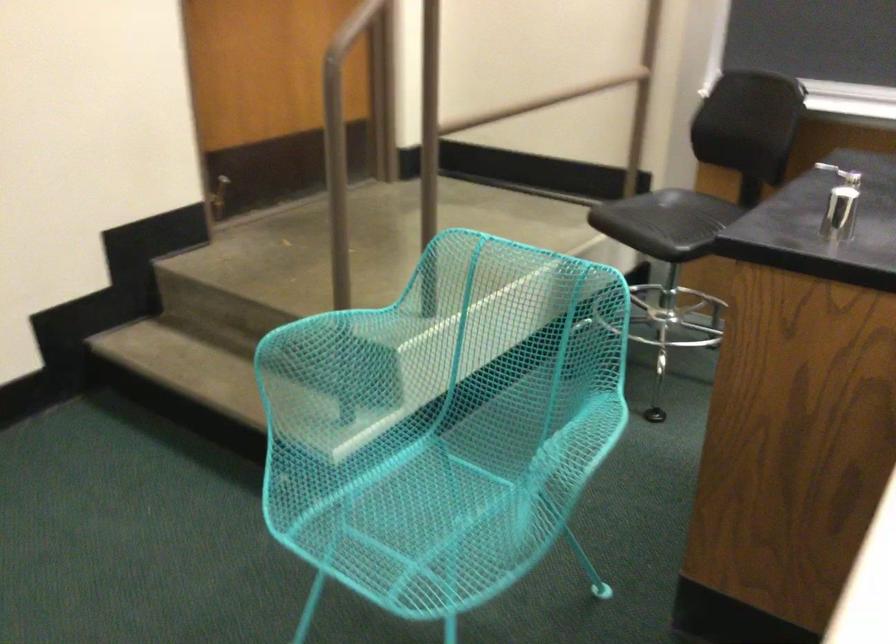
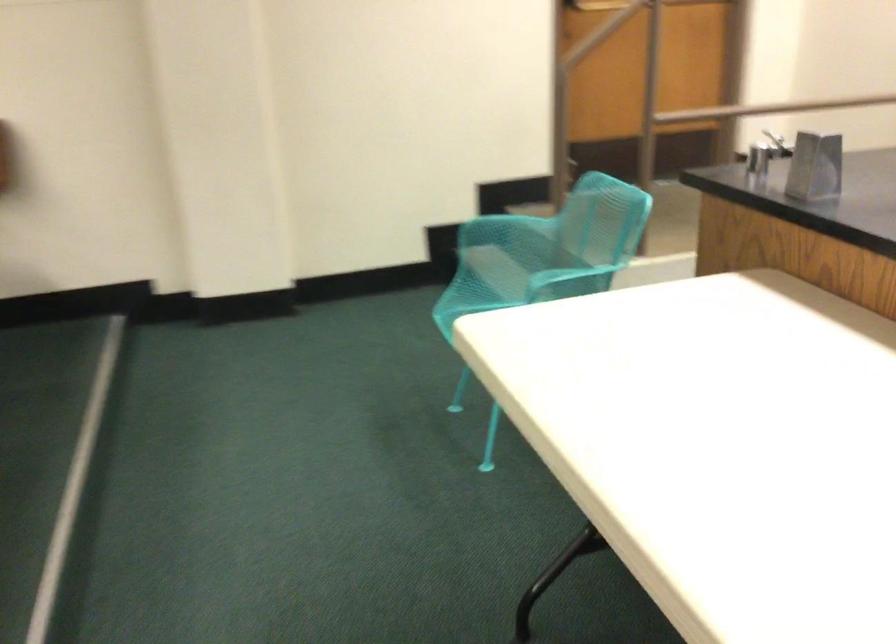
Where in the second image is the point corresponding to the point at 321,449 from the first image?

(487, 289)